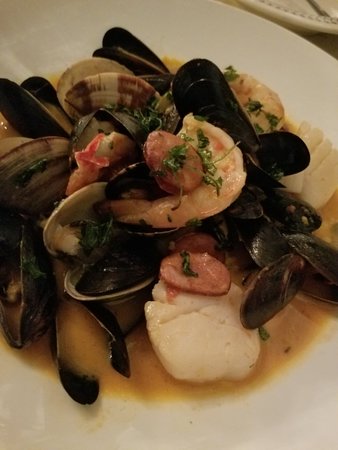
Identify the location of white plate. (258, 54).